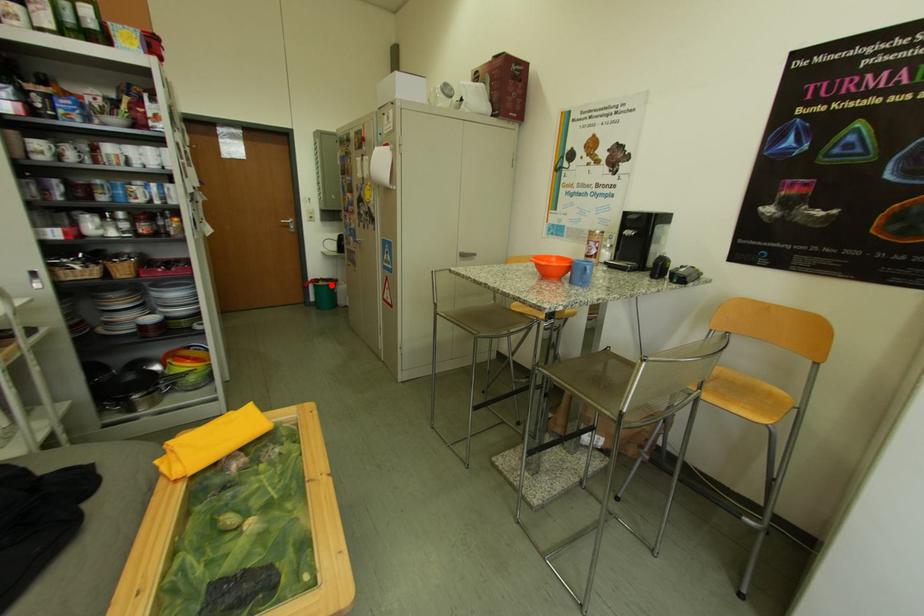
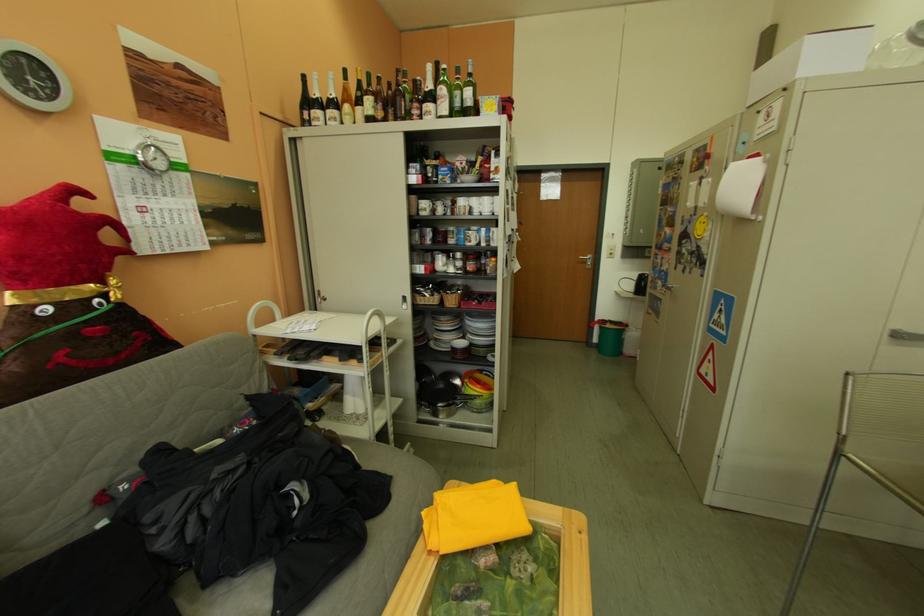
Where in the second image is the point corresponding to the highlighted location from the first image?

(617, 326)